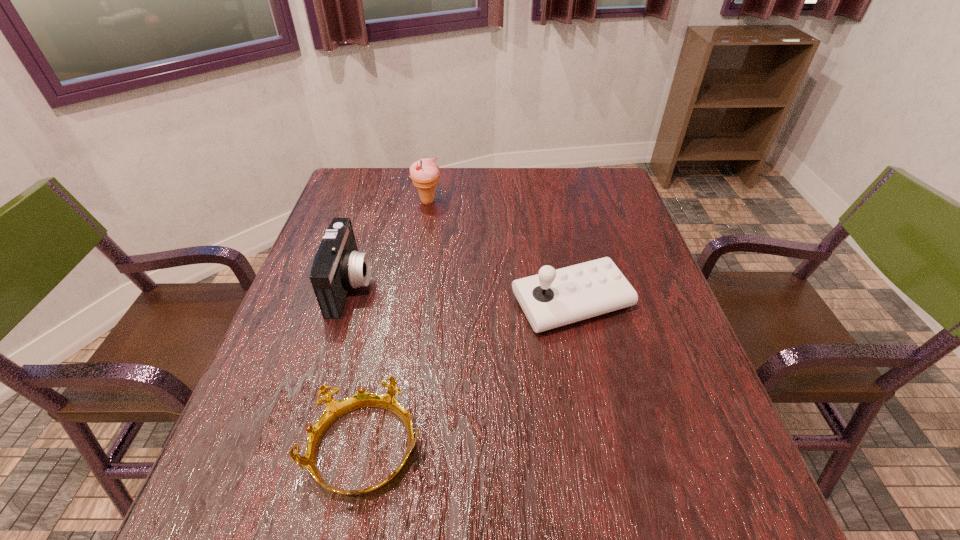
Find the location of a particular element. The width and height of the screenshot is (960, 540). free space at the near left corner of the desktop is located at coordinates (250, 501).

Locate an element on the screen. This screenshot has height=540, width=960. vacant area that lies between the crown and the joystick is located at coordinates (468, 376).

Where is `unoccupied area between the shortest object and the joystick`? This screenshot has width=960, height=540. unoccupied area between the shortest object and the joystick is located at coordinates (468, 376).

In order to click on free space between the rightmost object and the camcorder in this screenshot , I will do (462, 294).

This screenshot has width=960, height=540. I want to click on free spot between the farthest object and the joystick, so click(x=500, y=252).

Locate an element on the screen. This screenshot has width=960, height=540. vacant space that's between the rightmost object and the camcorder is located at coordinates (462, 294).

This screenshot has width=960, height=540. Find the location of `vacant area that lies between the nearest object and the icecream`. vacant area that lies between the nearest object and the icecream is located at coordinates (396, 326).

This screenshot has height=540, width=960. I want to click on vacant space that's between the crown and the farthest object, so click(396, 326).

Identify the location of free space that is in between the joystick and the nearest object. Image resolution: width=960 pixels, height=540 pixels. (468, 376).

Image resolution: width=960 pixels, height=540 pixels. In order to click on free space between the shortest object and the camcorder in this screenshot , I will do `click(358, 368)`.